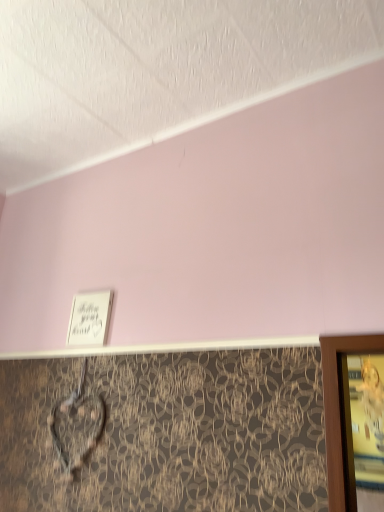
Question: Should I look upward or downward to see white paper at upper left?

Choices:
 (A) up
 (B) down

Answer: (B)